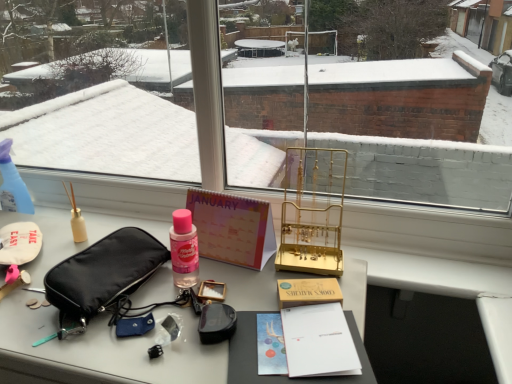
Question: Does point (14, 170) appear closer or farther from the camera than point (51, 261)?

Choices:
 (A) closer
 (B) farther

Answer: (B)

Question: Is transparent plastic spray bottle at left in front of or behind matte black pouch at left in the image?

Choices:
 (A) behind
 (B) front

Answer: (A)

Question: Based on their relative distances, which object is nearer to the black fabric pouch at left?

Choices:
 (A) gold metallic jewelry stand at center
 (B) transparent plastic spray bottle at left
 (C) matte black pouch at left
 (D) pastel paper calendar at center

Answer: (C)

Question: Which object is the closest to the gold metallic jewelry stand at center?

Choices:
 (A) black fabric pouch at left
 (B) pastel paper calendar at center
 (C) matte black pouch at left
 (D) transparent plastic spray bottle at left

Answer: (B)